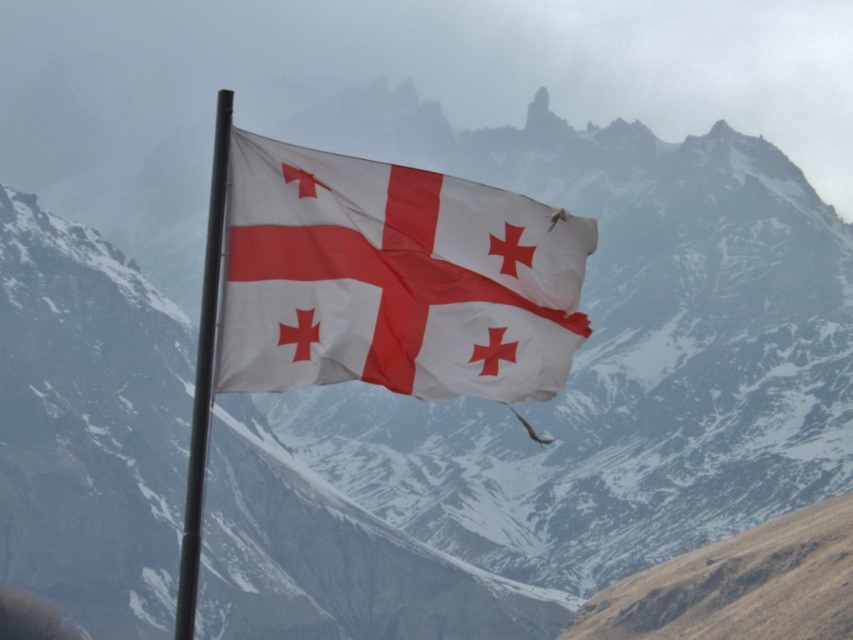
Is point (349, 369) closer to camera compared to point (187, 556)?

No, (349, 369) is behind (187, 556).

Is white fabric flag at center wider than black metal flag pole at center?

No, white fabric flag at center is not wider than black metal flag pole at center.

Which is behind, point (525, 211) or point (178, 612)?

Point (525, 211)

At what (x,y) coordinates should I click in order to perform the action: click on white fabric flag at center. Please return your answer as a coordinate pair (x, y). This screenshot has height=640, width=853. Looking at the image, I should click on (393, 280).